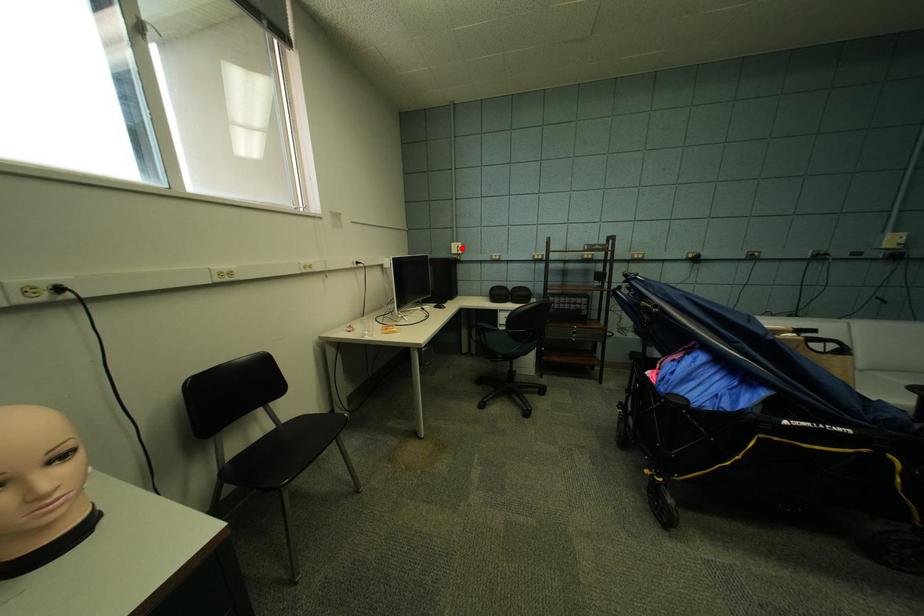
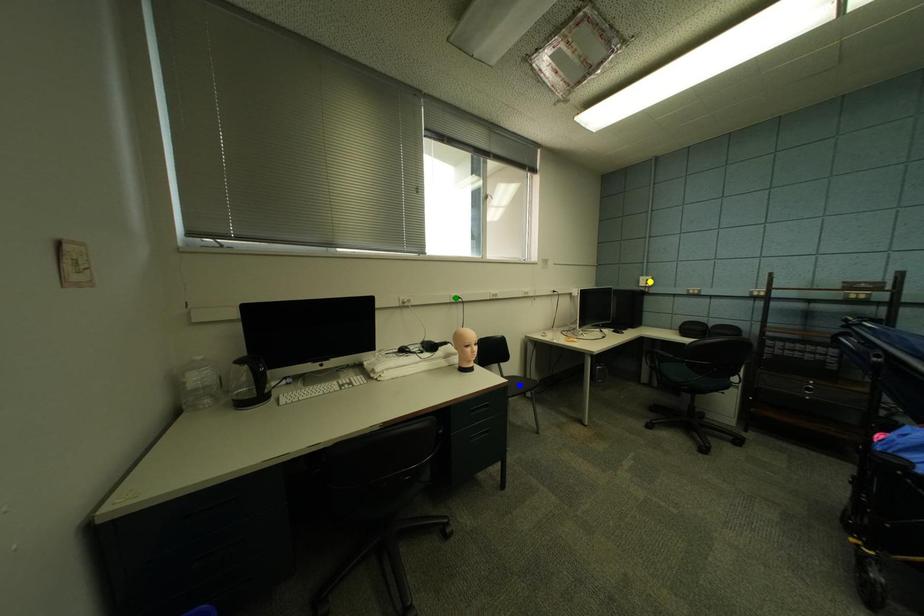
Question: I am providing you with two images of the same scene from different viewpoints. A red point is marked on the first image. You are given multiple points on the second image. Which point in image 2 is actually the same real-world point as the red point in image 1?

Choices:
 (A) blue point
 (B) green point
 (C) yellow point

Answer: (C)